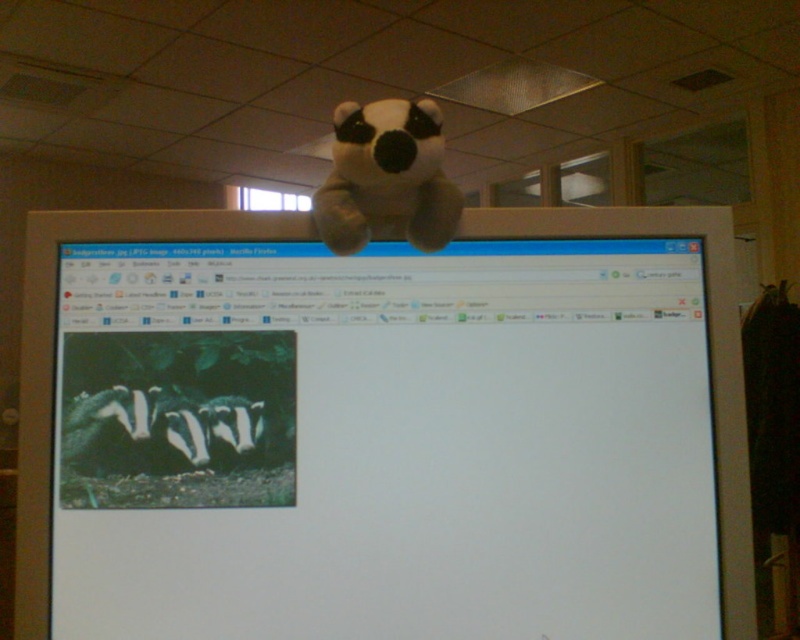
You are organizing a virtual tour of an office and need to place a 3D model of a badger plush toy on the monitor. The monitor is at point [414,432]. Where should you place the 3D model so that it appears to be sitting on the monitor?

Place the 3D model of the badger plush toy at the same coordinates as the white matte monitor at center, which is point [414,432], so it sits on the monitor.

You are organizing a desk and need to place a new item between the white matte monitor at center and the soft plush panda at upper center. Based on their positions, which object should you place the new item closer to?

The white matte monitor at center is on the right side of the soft plush panda at upper center, so the new item should be placed closer to the white matte monitor at center to maintain alignment with their positions.